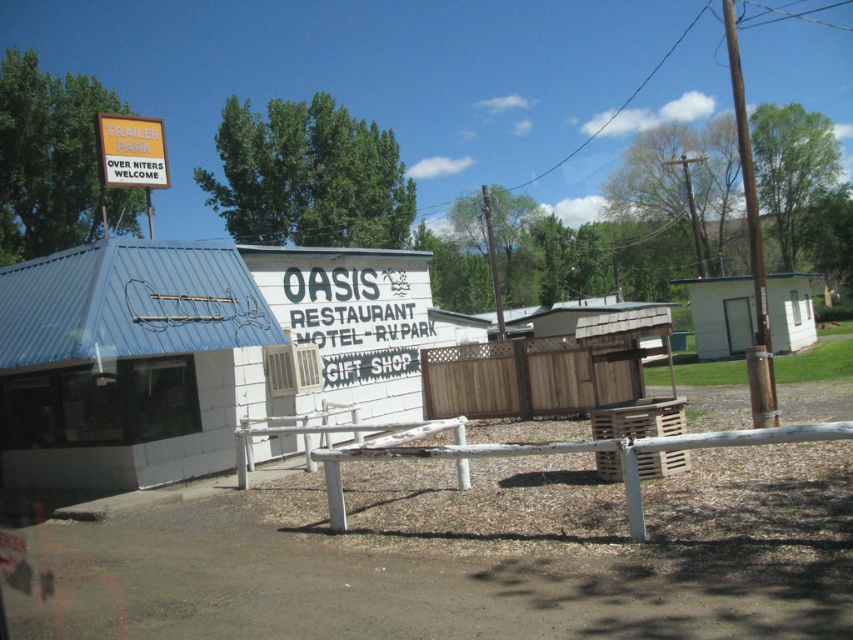
You are standing in front of the Oasis Restaurant Motel RV Park and need to find the gift shop entrance. You see a white wood fence at center and a yellow plastic sign at upper left. Which object is closer to the gift shop entrance?

The yellow plastic sign at upper left is closer to the gift shop entrance because the white wood fence at center is to the right of it, meaning the sign is positioned more towards the left side where the gift shop entrance might be located.

You are a customer arriving at the Oasis Restaurant Motel RV Park and want to enter the gift shop. You see a brown wood fence at center and a yellow plastic sign at upper left. Which object is closer to you as you approach the entrance?

The brown wood fence at center is closer to you because it is in front of the yellow plastic sign at upper left.

You are a customer standing in front of the Oasis Restaurant Motel RV Park and want to enter the gift shop. There are two fences in front of you, a brown wood fence at center and a white wood fence at center. Which fence is shorter and would allow easier access to the gift shop entrance?

The brown wood fence at center is shorter than the white wood fence at center, so it would allow easier access to the gift shop entrance.